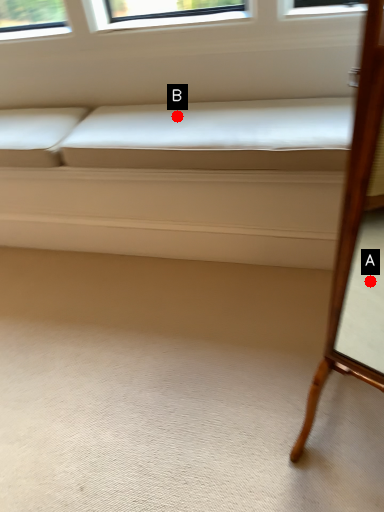
Question: Two points are circled on the image, labeled by A and B beside each circle. Which point is closer to the camera?

Choices:
 (A) A is closer
 (B) B is closer

Answer: (A)